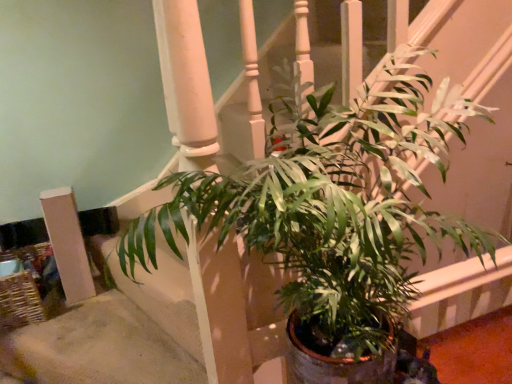
The image size is (512, 384). Describe the element at coordinates (333, 206) in the screenshot. I see `green glossy leafy plant at center` at that location.

Find the location of a particular element. Image resolution: width=512 pixels, height=384 pixels. green glossy leafy plant at center is located at coordinates pos(333,206).

Locate an element on the screen. The width and height of the screenshot is (512, 384). white matte pillar at lower left is located at coordinates (67, 244).

What do you see at coordinates (67, 244) in the screenshot? This screenshot has width=512, height=384. I see `white matte pillar at lower left` at bounding box center [67, 244].

Where is `green glossy leafy plant at center`? green glossy leafy plant at center is located at coordinates (333, 206).

Considering the positions of objects green glossy leafy plant at center and white matte pillar at lower left in the image provided, who is more to the right, green glossy leafy plant at center or white matte pillar at lower left?

green glossy leafy plant at center is more to the right.

Considering the relative positions of green glossy leafy plant at center and white matte pillar at lower left in the image provided, is green glossy leafy plant at center in front of white matte pillar at lower left?

Yes, green glossy leafy plant at center is closer to the viewer.

Which is behind, point (337, 188) or point (72, 195)?

The point (72, 195) is behind.

From the image's perspective, between green glossy leafy plant at center and white matte pillar at lower left, who is located below?

white matte pillar at lower left, from the image's perspective.

From a real-world perspective, is green glossy leafy plant at center over white matte pillar at lower left?

Correct, in the physical world, green glossy leafy plant at center is higher than white matte pillar at lower left.

Is green glossy leafy plant at center wider than white matte pillar at lower left?

Yes, green glossy leafy plant at center is wider than white matte pillar at lower left.

From their relative heights in the image, would you say green glossy leafy plant at center is taller or shorter than white matte pillar at lower left?

In the image, green glossy leafy plant at center appears to be taller than white matte pillar at lower left.

Does green glossy leafy plant at center have a larger size compared to white matte pillar at lower left?

Indeed, green glossy leafy plant at center has a larger size compared to white matte pillar at lower left.

Is green glossy leafy plant at center located outside white matte pillar at lower left?

Yes, green glossy leafy plant at center is not within white matte pillar at lower left.

Is green glossy leafy plant at center next to white matte pillar at lower left and touching it?

No, green glossy leafy plant at center is not making contact with white matte pillar at lower left.

Is green glossy leafy plant at center facing towards white matte pillar at lower left?

No.

How different are the orientations of green glossy leafy plant at center and white matte pillar at lower left in degrees?

The angular difference between green glossy leafy plant at center and white matte pillar at lower left is 0.386 degrees.

Consider the image. Measure the distance between green glossy leafy plant at center and white matte pillar at lower left.

The distance of green glossy leafy plant at center from white matte pillar at lower left is 1.10 meters.

The image size is (512, 384). I want to click on houseplant on the right of white matte pillar at lower left, so click(x=333, y=206).

Does white matte pillar at lower left appear on the left side of green glossy leafy plant at center?

Indeed, white matte pillar at lower left is positioned on the left side of green glossy leafy plant at center.

Does white matte pillar at lower left come in front of green glossy leafy plant at center?

No.

Which is further, [46,197] or [142,240]?

Point [46,197]

From the image's perspective, is white matte pillar at lower left above green glossy leafy plant at center?

No, from the image's perspective, white matte pillar at lower left is not over green glossy leafy plant at center.

From a real-world perspective, who is located lower, white matte pillar at lower left or green glossy leafy plant at center?

white matte pillar at lower left, from a real-world perspective.

Which of these two, white matte pillar at lower left or green glossy leafy plant at center, is wider?

Wider between the two is green glossy leafy plant at center.

Considering the sizes of white matte pillar at lower left and green glossy leafy plant at center in the image, is white matte pillar at lower left taller or shorter than green glossy leafy plant at center?

white matte pillar at lower left is shorter than green glossy leafy plant at center.

Considering the sizes of objects white matte pillar at lower left and green glossy leafy plant at center in the image provided, who is smaller, white matte pillar at lower left or green glossy leafy plant at center?

white matte pillar at lower left is smaller.

Could green glossy leafy plant at center be considered to be inside white matte pillar at lower left?

Actually, green glossy leafy plant at center is outside white matte pillar at lower left.

Is white matte pillar at lower left positioned far away from green glossy leafy plant at center?

That's right, there is a large distance between white matte pillar at lower left and green glossy leafy plant at center.

Is white matte pillar at lower left turned away from green glossy leafy plant at center?

white matte pillar at lower left is not turned away from green glossy leafy plant at center.

Can you tell me how much white matte pillar at lower left and green glossy leafy plant at center differ in facing direction?

The angular difference between white matte pillar at lower left and green glossy leafy plant at center is 0.386 degrees.

Measure the distance between white matte pillar at lower left and green glossy leafy plant at center.

The distance of white matte pillar at lower left from green glossy leafy plant at center is 1.10 meters.

Image resolution: width=512 pixels, height=384 pixels. In order to click on pillar located below the green glossy leafy plant at center (from the image's perspective) in this screenshot , I will do `click(67, 244)`.

This screenshot has height=384, width=512. In order to click on houseplant above the white matte pillar at lower left (from a real-world perspective) in this screenshot , I will do `click(333, 206)`.

Identify the location of houseplant above the white matte pillar at lower left (from the image's perspective). The width and height of the screenshot is (512, 384). (333, 206).